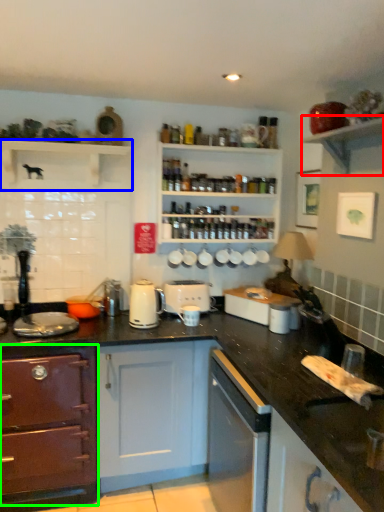
Question: Which object is the closest to the shelf (highlighted by a red box)? Choose among these: shelf (highlighted by a blue box) or cabinetry (highlighted by a green box).

Choices:
 (A) shelf
 (B) cabinetry

Answer: (A)